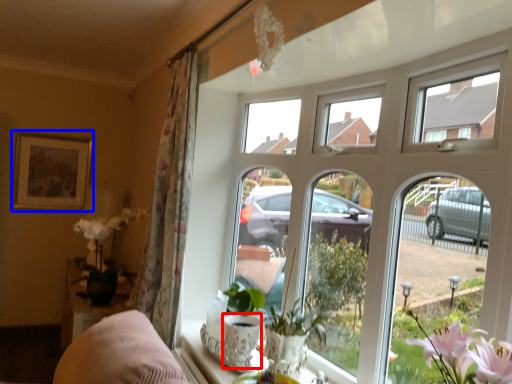
Question: Which object is closer to the camera taking this photo, glass vase (highlighted by a red box) or picture frame (highlighted by a blue box)?

Choices:
 (A) glass vase
 (B) picture frame

Answer: (A)